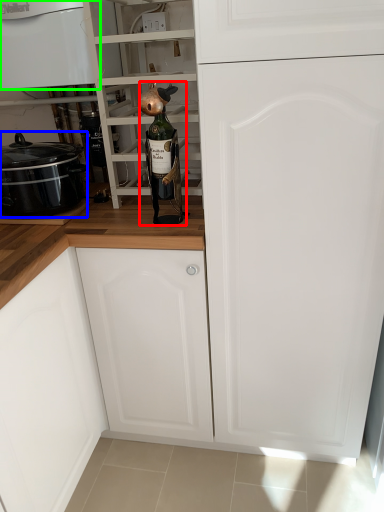
Question: Which object is the closest to the beer bottle (highlighted by a red box)? Choose among these: kitchen appliance (highlighted by a blue box) or home appliance (highlighted by a green box).

Choices:
 (A) kitchen appliance
 (B) home appliance

Answer: (A)